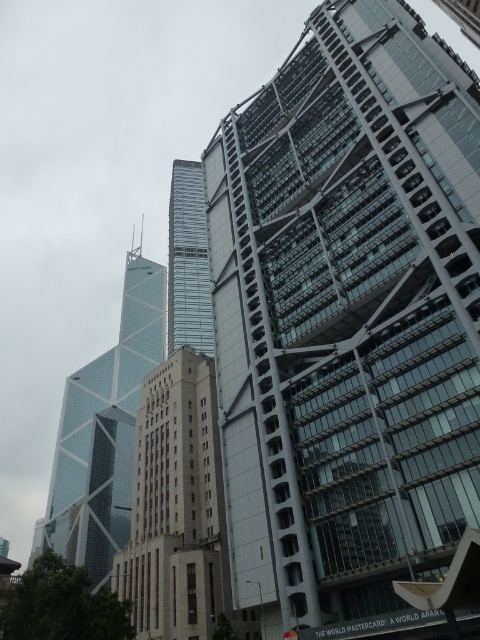
What are the coordinates of the glassy steel skyscraper at upper right in the image?

The glassy steel skyscraper at upper right is located at coordinates point (348, 321).

Looking at this image, you are standing in the city square and want to take a photo of both the beige concrete building at center and the glassy steel tower at center. Which building should you move towards to get both in the frame without zooming?

You should move towards the beige concrete building at center because it is closer to you than the glassy steel tower at center, so adjusting your position closer to it will help both structures appear more balanced in the photo frame.